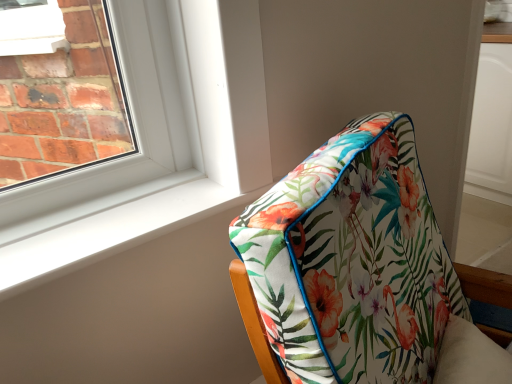
Question: Is floral fabric cushion at center oriented away from white smooth window sill at lower left?

Choices:
 (A) no
 (B) yes

Answer: (B)

Question: Can you confirm if floral fabric cushion at center is wider than white smooth window sill at lower left?

Choices:
 (A) yes
 (B) no

Answer: (A)

Question: Does floral fabric cushion at center have a lesser height compared to white smooth window sill at lower left?

Choices:
 (A) no
 (B) yes

Answer: (A)

Question: From a real-world perspective, is floral fabric cushion at center positioned under white smooth window sill at lower left based on gravity?

Choices:
 (A) no
 (B) yes

Answer: (B)

Question: Is floral fabric cushion at center to the left of white smooth window sill at lower left from the viewer's perspective?

Choices:
 (A) no
 (B) yes

Answer: (A)

Question: Can you confirm if floral fabric cushion at center is smaller than white smooth window sill at lower left?

Choices:
 (A) no
 (B) yes

Answer: (A)

Question: Is white smooth window sill at lower left aimed at floral fabric cushion at center?

Choices:
 (A) no
 (B) yes

Answer: (B)

Question: From the image's perspective, is white smooth window sill at lower left under floral fabric cushion at center?

Choices:
 (A) no
 (B) yes

Answer: (A)

Question: Is white smooth window sill at lower left taller than floral fabric cushion at center?

Choices:
 (A) no
 (B) yes

Answer: (A)

Question: Is white smooth window sill at lower left next to floral fabric cushion at center and touching it?

Choices:
 (A) no
 (B) yes

Answer: (A)

Question: Is white smooth window sill at lower left oriented away from floral fabric cushion at center?

Choices:
 (A) no
 (B) yes

Answer: (A)

Question: Is white smooth window sill at lower left thinner than floral fabric cushion at center?

Choices:
 (A) no
 (B) yes

Answer: (B)

Question: Is white smooth window sill at lower left spatially inside floral fabric cushion at center, or outside of it?

Choices:
 (A) outside
 (B) inside

Answer: (A)